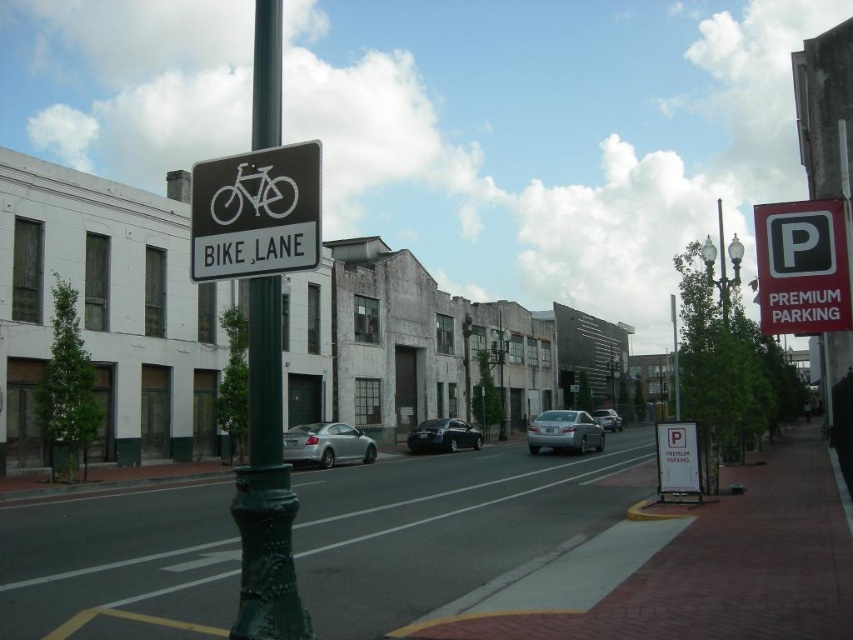
Question: Is shiny dark blue sedan at center smaller than green glass lamp post at upper center?

Choices:
 (A) no
 (B) yes

Answer: (B)

Question: Among these objects, which one is nearest to the camera?

Choices:
 (A) green glass lamp post at upper center
 (B) white plastic bike lane sign at upper center
 (C) red plastic parking sign at upper right

Answer: (B)

Question: Which point is farther from the camera taking this photo?

Choices:
 (A) (207, 227)
 (B) (259, 125)

Answer: (A)

Question: Is white plastic bike lane sign at upper center above green glass lamp post at upper center?

Choices:
 (A) yes
 (B) no

Answer: (B)

Question: Does white plastic bike lane sign at upper center appear under metallic gray streetlamp at center?

Choices:
 (A) yes
 (B) no

Answer: (B)

Question: Which object is positioned closest to the satin silver sedan at center?

Choices:
 (A) green metal pole at center
 (B) white plastic bicycle at upper center

Answer: (A)